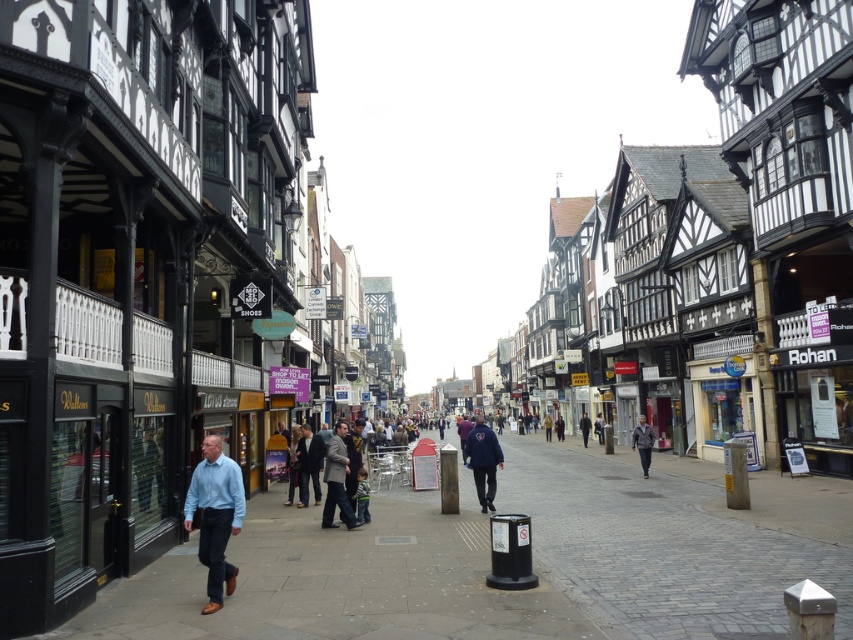
Question: Which object is the farthest from the light blue shirt at lower left?

Choices:
 (A) light brown leather jacket at center
 (B) gray fabric jacket at center
 (C) blue fleece jacket at center

Answer: (A)

Question: Does dark gray coat at center come in front of light brown leather jacket at center?

Choices:
 (A) yes
 (B) no

Answer: (A)

Question: Among these points, which one is farthest from the camera?

Choices:
 (A) (312, 481)
 (B) (585, 442)
 (C) (546, 417)
 (D) (341, 476)

Answer: (C)

Question: Can you confirm if light blue shirt at lower left is positioned below gray fabric jacket at center?

Choices:
 (A) yes
 (B) no

Answer: (B)

Question: Which object is the closest to the dark gray suit at center?

Choices:
 (A) light blue shirt at lower left
 (B) light brown leather jacket at center

Answer: (A)

Question: Is light blue shirt at lower left positioned in front of gray fabric jacket at center?

Choices:
 (A) no
 (B) yes

Answer: (B)